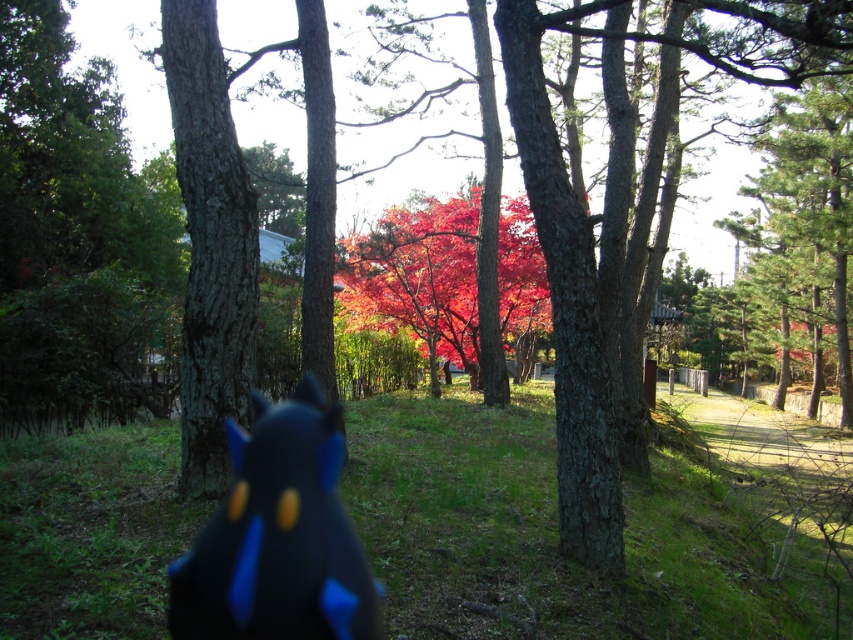
Question: Which of the following is the farthest from the observer?

Choices:
 (A) vivid red leaves at center
 (B) matte black plush toy at center

Answer: (A)

Question: Can you confirm if matte black plush toy at center is positioned to the right of vivid red leaves at center?

Choices:
 (A) no
 (B) yes

Answer: (A)

Question: Which object appears farthest from the camera in this image?

Choices:
 (A) matte black plush toy at center
 (B) vivid red leaves at center

Answer: (B)

Question: Does matte black plush toy at center appear on the left side of vivid red leaves at center?

Choices:
 (A) no
 (B) yes

Answer: (B)

Question: From the image, what is the correct spatial relationship of matte black plush toy at center in relation to vivid red leaves at center?

Choices:
 (A) above
 (B) below

Answer: (B)